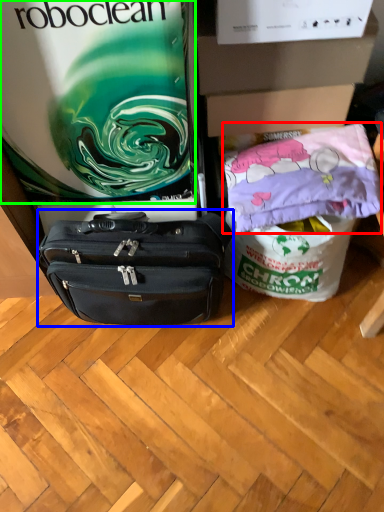
Question: Which object is positioned farthest from material (highlighted by a red box)? Select from luggage and bags (highlighted by a blue box) and gift bag (highlighted by a green box).

Choices:
 (A) luggage and bags
 (B) gift bag

Answer: (B)